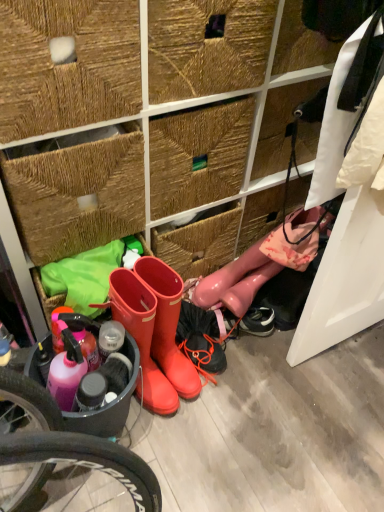
Question: Is rubber boots at center, which appears as the second footwear when viewed from the right, outside rubber boots at center, the 1th footwear viewed from the left?

Choices:
 (A) yes
 (B) no

Answer: (A)

Question: Considering the relative sizes of rubber boots at center, which appears as the second footwear when viewed from the right, and rubber boots at center, the 3th footwear positioned from the right, in the image provided, is rubber boots at center, which appears as the second footwear when viewed from the right, smaller than rubber boots at center, the 3th footwear positioned from the right,?

Choices:
 (A) no
 (B) yes

Answer: (B)

Question: Considering the relative positions of rubber boots at center, which is the 2th footwear from left to right, and rubber boots at center, the 1th footwear viewed from the left, in the image provided, is rubber boots at center, which is the 2th footwear from left to right, to the right of rubber boots at center, the 1th footwear viewed from the left, from the viewer's perspective?

Choices:
 (A) no
 (B) yes

Answer: (B)

Question: Considering the relative sizes of rubber boots at center, which appears as the second footwear when viewed from the right, and rubber boots at center, the 3th footwear positioned from the right, in the image provided, is rubber boots at center, which appears as the second footwear when viewed from the right, bigger than rubber boots at center, the 3th footwear positioned from the right,?

Choices:
 (A) no
 (B) yes

Answer: (A)

Question: From the image's perspective, does rubber boots at center, which is the 2th footwear from left to right, appear lower than rubber boots at center, the 3th footwear positioned from the right?

Choices:
 (A) no
 (B) yes

Answer: (A)

Question: Is rubber boots at center, which is the 2th footwear from left to right, bigger or smaller than glossy pink boots at lower right, which is counted as the third footwear, starting from the left?

Choices:
 (A) big
 (B) small

Answer: (A)

Question: From a real-world perspective, is rubber boots at center, which is the 2th footwear from left to right, above or below glossy pink boots at lower right, which is counted as the third footwear, starting from the left?

Choices:
 (A) above
 (B) below

Answer: (B)

Question: Which is correct: rubber boots at center, which is the 2th footwear from left to right, is inside glossy pink boots at lower right, marked as the first footwear in a right-to-left arrangement, or outside of it?

Choices:
 (A) outside
 (B) inside

Answer: (A)

Question: Relative to glossy pink boots at lower right, which is counted as the third footwear, starting from the left, is rubber boots at center, which appears as the second footwear when viewed from the right, in front or behind?

Choices:
 (A) behind
 (B) front

Answer: (B)

Question: Considering the positions of rubber boots at center, the 1th footwear viewed from the left, and rubber boots at center, which appears as the second footwear when viewed from the right, in the image, is rubber boots at center, the 1th footwear viewed from the left, taller or shorter than rubber boots at center, which appears as the second footwear when viewed from the right,?

Choices:
 (A) tall
 (B) short

Answer: (B)

Question: Considering the positions of point (144, 290) and point (157, 268), is point (144, 290) closer or farther from the camera than point (157, 268)?

Choices:
 (A) closer
 (B) farther

Answer: (A)

Question: Which is correct: rubber boots at center, the 3th footwear positioned from the right, is inside rubber boots at center, which appears as the second footwear when viewed from the right, or outside of it?

Choices:
 (A) inside
 (B) outside

Answer: (B)

Question: From a real-world perspective, is rubber boots at center, the 1th footwear viewed from the left, above or below rubber boots at center, which is the 2th footwear from left to right?

Choices:
 (A) above
 (B) below

Answer: (A)

Question: Is glossy pink boots at lower right, which is counted as the third footwear, starting from the left, wider or thinner than rubber boots at center, which appears as the second footwear when viewed from the right?

Choices:
 (A) thin
 (B) wide

Answer: (A)

Question: From a real-world perspective, is glossy pink boots at lower right, which is counted as the third footwear, starting from the left, positioned above or below rubber boots at center, which appears as the second footwear when viewed from the right?

Choices:
 (A) below
 (B) above

Answer: (B)